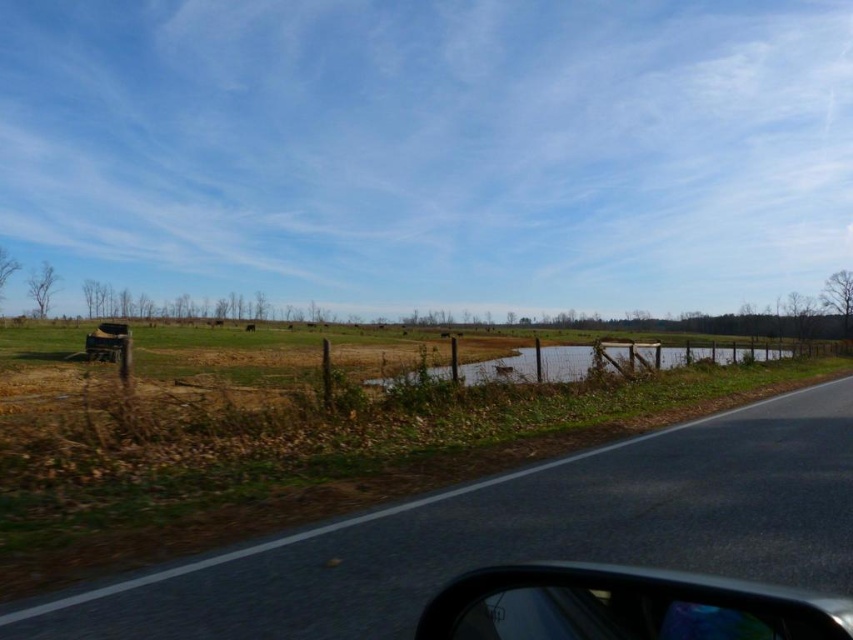
Who is more forward, (x=688, y=634) or (x=105, y=326)?

Point (x=688, y=634) is more forward.

Which of these two, glossy plastic car at lower right or brushed metal jeep at lower left, stands taller?

With more height is brushed metal jeep at lower left.

Identify the location of glossy plastic car at lower right. (624, 605).

Find the location of `glossy plastic car at lower right`. glossy plastic car at lower right is located at coordinates (624, 605).

This screenshot has height=640, width=853. Describe the element at coordinates (517, 532) in the screenshot. I see `asphalt road at lower right` at that location.

Is asphalt road at lower right taller than brown grassy flood at center?

In fact, asphalt road at lower right may be shorter than brown grassy flood at center.

Identify the location of asphalt road at lower right. (517, 532).

Describe the element at coordinates (601, 360) in the screenshot. The height and width of the screenshot is (640, 853). I see `brown grassy flood at center` at that location.

This screenshot has width=853, height=640. I want to click on brown grassy flood at center, so click(601, 360).